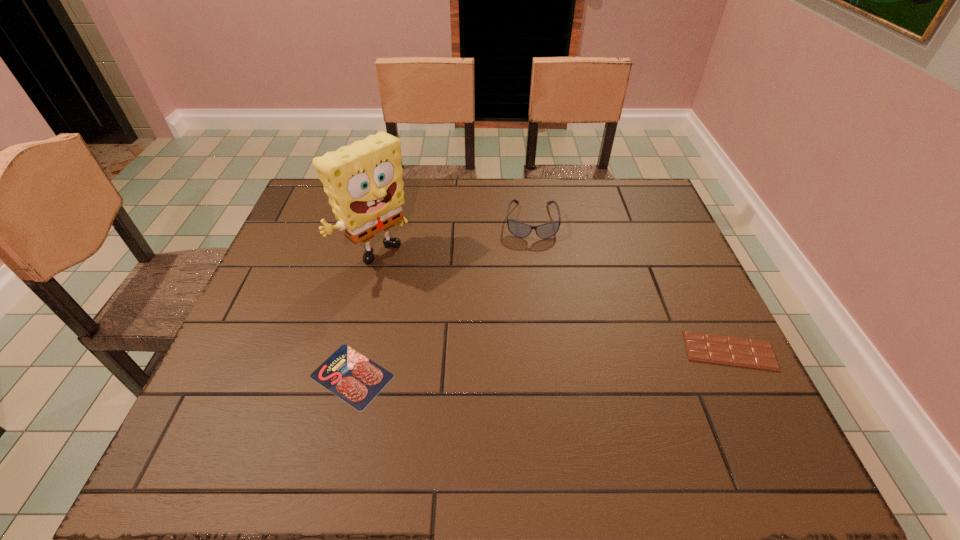
Identify the location of vacant space located on the face of the tallest object. (493, 357).

Locate an element on the screen. This screenshot has height=540, width=960. free space located 0.070m on the face of the tallest object is located at coordinates (414, 292).

This screenshot has width=960, height=540. Identify the location of vacant space located 0.290m on the face of the tallest object. (474, 342).

You are a GUI agent. You are given a task and a screenshot of the screen. Output one action in this format:
    pyautogui.click(x=<x>, y=<y>)
    Task: Click on the object that is positioned at the far edge
    Image resolution: width=960 pixels, height=540 pixels.
    Given the screenshot: What is the action you would take?
    pyautogui.click(x=518, y=229)

Where is `object located at the near edge`? object located at the near edge is located at coordinates (354, 378).

Where is `object at the right edge`? Image resolution: width=960 pixels, height=540 pixels. object at the right edge is located at coordinates (726, 350).

At what (x,y) coordinates should I click in order to perform the action: click on free point at the far edge. Please return your answer as a coordinate pair (x, y). Looking at the image, I should click on (406, 198).

In order to click on vacant position at the near edge of the desktop in this screenshot , I will do `click(386, 397)`.

At what (x,y) coordinates should I click in order to perform the action: click on free space at the left edge of the desktop. Please return your answer as a coordinate pair (x, y). Image resolution: width=960 pixels, height=540 pixels. Looking at the image, I should click on (271, 338).

You are a GUI agent. You are given a task and a screenshot of the screen. Output one action in this format:
    pyautogui.click(x=<x>, y=<y>)
    Task: Click on the vacant area at the right edge of the desktop
    The image size is (960, 540).
    Given the screenshot: What is the action you would take?
    pyautogui.click(x=668, y=347)